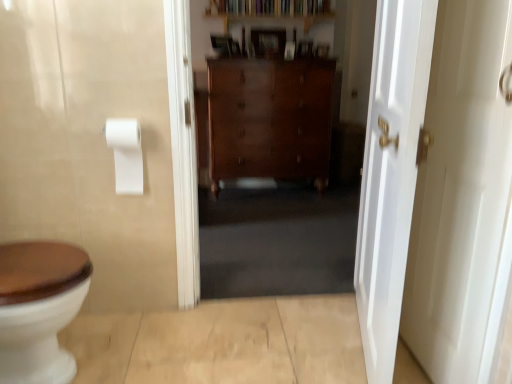
Question: Is wooden bookshelf at upper center wider than polished wood dresser at center?

Choices:
 (A) no
 (B) yes

Answer: (A)

Question: Is wooden bookshelf at upper center positioned with its back to polished wood dresser at center?

Choices:
 (A) no
 (B) yes

Answer: (A)

Question: Does wooden bookshelf at upper center have a lesser width compared to polished wood dresser at center?

Choices:
 (A) yes
 (B) no

Answer: (A)

Question: Does wooden bookshelf at upper center have a larger size compared to polished wood dresser at center?

Choices:
 (A) no
 (B) yes

Answer: (A)

Question: From the image's perspective, is wooden bookshelf at upper center beneath polished wood dresser at center?

Choices:
 (A) yes
 (B) no

Answer: (B)

Question: From a real-world perspective, is wooden bookshelf at upper center physically below polished wood dresser at center?

Choices:
 (A) yes
 (B) no

Answer: (B)

Question: From a real-world perspective, is polished wood dresser at center over wooden bookshelf at upper center?

Choices:
 (A) no
 (B) yes

Answer: (A)

Question: Is polished wood dresser at center wider than wooden bookshelf at upper center?

Choices:
 (A) no
 (B) yes

Answer: (B)

Question: Is polished wood dresser at center positioned far away from wooden bookshelf at upper center?

Choices:
 (A) yes
 (B) no

Answer: (B)

Question: Is polished wood dresser at center turned away from wooden bookshelf at upper center?

Choices:
 (A) yes
 (B) no

Answer: (B)

Question: From a real-world perspective, is polished wood dresser at center beneath wooden bookshelf at upper center?

Choices:
 (A) yes
 (B) no

Answer: (A)

Question: Does polished wood dresser at center have a larger size compared to wooden bookshelf at upper center?

Choices:
 (A) yes
 (B) no

Answer: (A)

Question: From a real-world perspective, is white matte toilet paper at upper left located higher than white glossy door at right, arranged as the first door when viewed from the left?

Choices:
 (A) yes
 (B) no

Answer: (A)